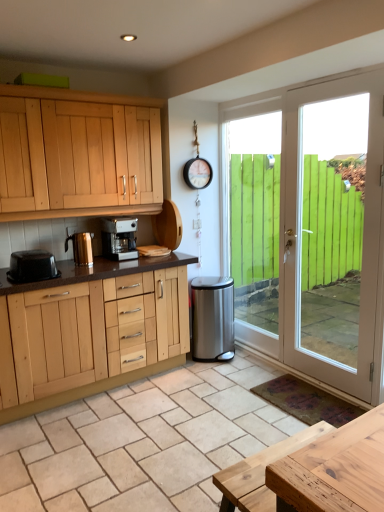
Where is `free space in front of stainless steel trash can at lower right`? free space in front of stainless steel trash can at lower right is located at coordinates (229, 372).